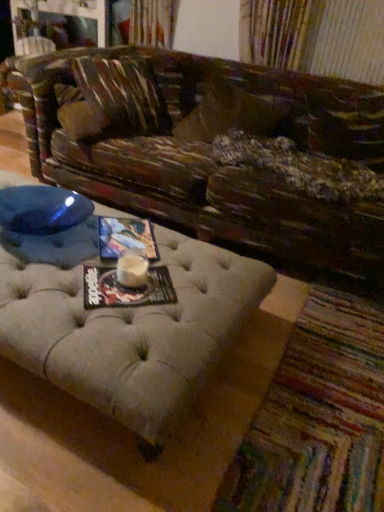
This screenshot has height=512, width=384. I want to click on vacant location below beige tufted ottoman at lower center (from a real-world perspective), so click(341, 387).